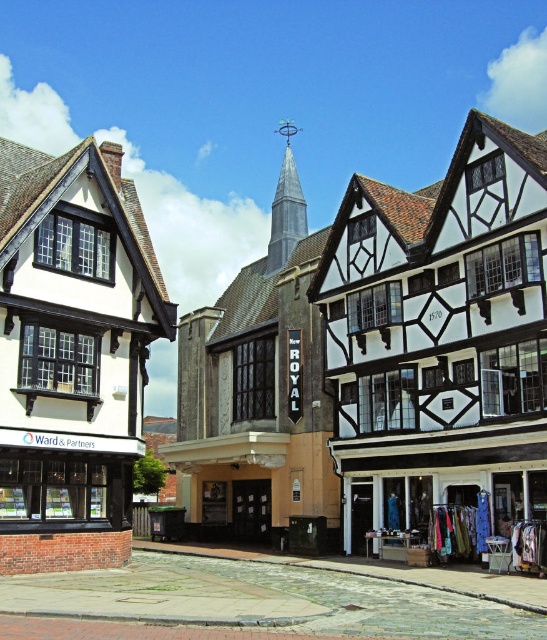
Question: Which object appears farthest from the camera in this image?

Choices:
 (A) white timber-framed building at center
 (B) textured fabric clothes at lower right

Answer: (B)

Question: Can you confirm if white timber-framed building at center is bigger than textured fabric clothes at lower right?

Choices:
 (A) no
 (B) yes

Answer: (B)

Question: From the image, what is the correct spatial relationship of white timber-framed building at center in relation to textured fabric clothes at lower right?

Choices:
 (A) above
 (B) below

Answer: (A)

Question: Is white timber-framed building at center thinner than textured fabric clothes at lower right?

Choices:
 (A) yes
 (B) no

Answer: (B)

Question: Among these points, which one is farthest from the camera?

Choices:
 (A) (197, 524)
 (B) (444, 529)

Answer: (A)